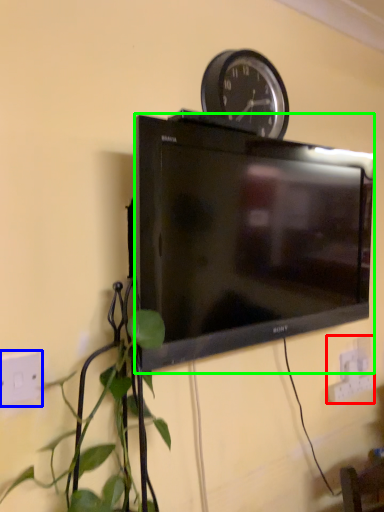
Question: Which object is positioned farthest from electric outlet (highlighted by a red box)? Select from electric outlet (highlighted by a blue box) and television (highlighted by a green box).

Choices:
 (A) electric outlet
 (B) television

Answer: (A)